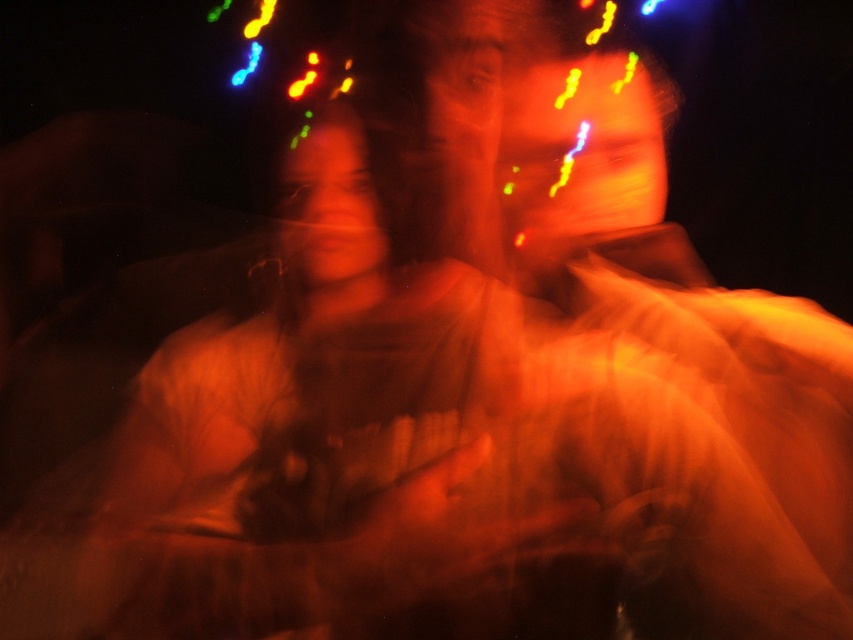
Based on the scene description, which object is taller between the matte orange shirt at center and the orange matte face at upper center?

The matte orange shirt at center is taller than the orange matte face at upper center according to the description.

You are standing at the point labeled point (x=227, y=636) in a dark, blurred environment with two people nearby. You need to reach a light source that is 3 feet away from you. Can you safely move forward without hitting the two people?

The point labeled point (x=227, y=636) is 32.22 inches away from the viewer. Since 32.22 inches is approximately 2.68 feet, which is less than 3 feet, moving forward might bring you closer to the two people. Therefore, it is not safe to move forward without potentially hitting them.

You are a photographer analyzing the image. You notice a point at coordinate (592, 148). What object is located at this point?

The orange matte face at upper center is located at point (592, 148).